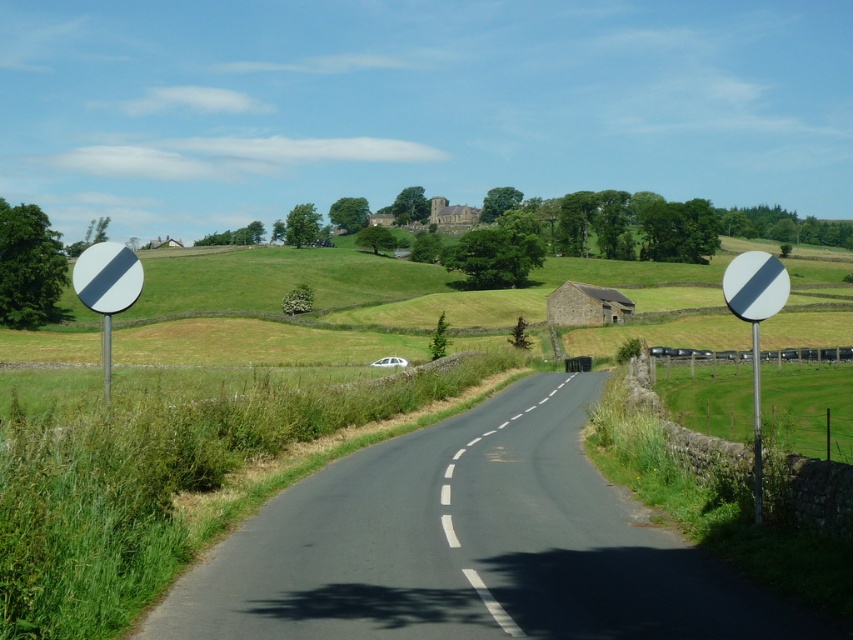
Question: Is the position of white glossy circle at left more distant than that of white reflective triangle at left?

Choices:
 (A) yes
 (B) no

Answer: (A)

Question: Which point is closer to the camera taking this photo?

Choices:
 (A) (74, 289)
 (B) (786, 280)
 (C) (134, 272)

Answer: (A)

Question: Considering the real-world distances, which object is closest to the white glossy circle at left?

Choices:
 (A) white reflective circle at right
 (B) white reflective triangle at left
 (C) white glossy circle at right

Answer: (B)

Question: Is the position of white glossy circle at left less distant than that of white reflective triangle at left?

Choices:
 (A) yes
 (B) no

Answer: (B)

Question: Among these points, which one is nearest to the camera?

Choices:
 (A) (759, 308)
 (B) (88, 260)

Answer: (A)

Question: Does white glossy circle at right appear under white glossy circle at left?

Choices:
 (A) no
 (B) yes

Answer: (B)